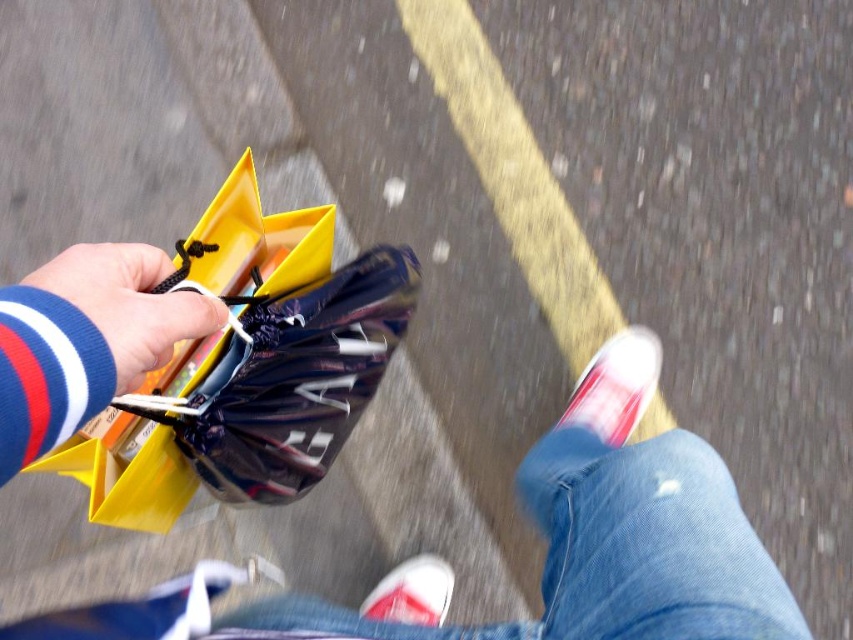
Question: Which point is farther from the camera taking this photo?

Choices:
 (A) (425, 586)
 (B) (618, 417)
 (C) (114, 346)

Answer: (A)

Question: From the image, what is the correct spatial relationship of matte yellow plastic bag at lower left in relation to white canvas shoe at lower center?

Choices:
 (A) right
 (B) left

Answer: (B)

Question: Which point is closer to the camera taking this photo?

Choices:
 (A) (303, 372)
 (B) (424, 598)
 (C) (111, 348)
 (D) (682, 624)

Answer: (C)

Question: Is matte yellow plastic bag at lower left smaller than white canvas shoe at lower right?

Choices:
 (A) yes
 (B) no

Answer: (B)

Question: Does matte black shoes at lower center have a smaller size compared to white canvas shoe at lower right?

Choices:
 (A) yes
 (B) no

Answer: (B)

Question: Among these points, which one is nearest to the camera?

Choices:
 (A) (412, 556)
 (B) (630, 422)
 (C) (370, 332)
 (D) (132, 369)

Answer: (D)